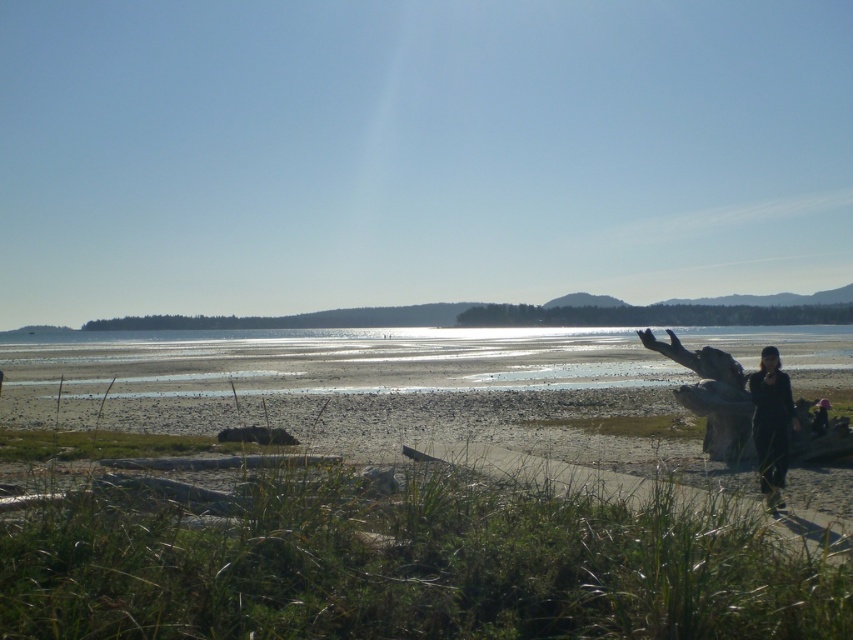
You are a photographer planning to take a wide shot of the beach scene. You want to ensure that both the clear sand at lower center and the black matte clothing at lower right are visible in the frame. Considering their sizes, which object will occupy more space in the photo?

The clear sand at lower center will occupy more space in the photo because it is bigger than the black matte clothing at lower right.

You are standing on the beach and want to walk from the smooth sand beach at lower right to the clear sand at lower center. Which direction should you move to reach your destination?

To reach the clear sand at lower center from the smooth sand beach at lower right, you should move backward since the smooth sand beach at lower right is in front of the clear sand at lower center.